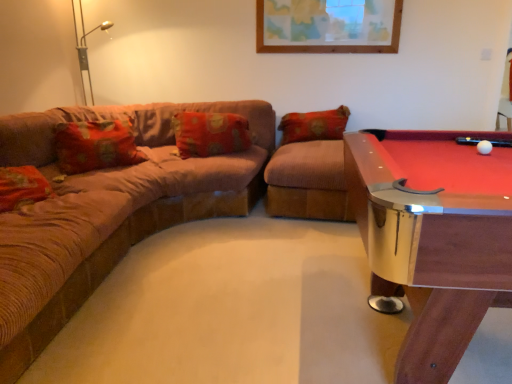
The height and width of the screenshot is (384, 512). What do you see at coordinates (111, 211) in the screenshot? I see `brown corduroy couch at left` at bounding box center [111, 211].

This screenshot has width=512, height=384. What do you see at coordinates (434, 237) in the screenshot? I see `wooden pool table at right` at bounding box center [434, 237].

The width and height of the screenshot is (512, 384). In order to click on brown corduroy couch at left in this screenshot , I will do `click(111, 211)`.

In terms of size, does brown corduroy couch at left appear bigger or smaller than wooden pool table at right?

brown corduroy couch at left is bigger than wooden pool table at right.

Which is behind, brown corduroy couch at left or wooden pool table at right?

wooden pool table at right is behind.

Between point (224, 205) and point (442, 185), which one is positioned in front?

Point (442, 185)

Does wooden pool table at right have a smaller size compared to brown corduroy couch at left?

Yes, wooden pool table at right is smaller than brown corduroy couch at left.

From a real-world perspective, is wooden pool table at right positioned under brown corduroy couch at left based on gravity?

No, from a real-world perspective, wooden pool table at right is not below brown corduroy couch at left.

Considering the sizes of objects wooden pool table at right and brown corduroy couch at left in the image provided, who is shorter, wooden pool table at right or brown corduroy couch at left?

Result: brown corduroy couch at left is shorter.

From the image's perspective, is wooden pool table at right over brown corduroy couch at left?

Actually, wooden pool table at right appears below brown corduroy couch at left in the image.

Is floral fabric pillow at center oriented towards brown corduroy couch at left?

Yes.

Which of these two, floral fabric pillow at center or brown corduroy couch at left, is bigger?

brown corduroy couch at left.

Is floral fabric pillow at center outside of brown corduroy couch at left?

That's incorrect, floral fabric pillow at center is not completely outside brown corduroy couch at left.

Which object is positioned more to the right, floral fabric pillow at center or brown corduroy couch at left?

Positioned to the right is floral fabric pillow at center.

Is floral fabric pillow at center situated inside wooden pool table at right or outside?

floral fabric pillow at center is spatially situated outside wooden pool table at right.

Is floral fabric pillow at center placed right next to wooden pool table at right?

No, floral fabric pillow at center is not in contact with wooden pool table at right.

Find the location of a particular element. The image size is (512, 384). billiard table to the right of floral fabric pillow at center is located at coordinates tap(434, 237).

From a real-world perspective, which object stands above the other?

From a 3D spatial view, floral fabric pillow at center is above.

Between wooden pool table at right and floral fabric pillow at center, which one appears on the left side from the viewer's perspective?

Positioned to the left is floral fabric pillow at center.

From a real-world perspective, is wooden pool table at right positioned over floral fabric pillow at center based on gravity?

No, from a real-world perspective, wooden pool table at right is not on top of floral fabric pillow at center.

In terms of height, does wooden pool table at right look taller or shorter compared to floral fabric pillow at center?

In the image, wooden pool table at right appears to be taller than floral fabric pillow at center.

Is wooden pool table at right directly adjacent to floral fabric pillow at center?

wooden pool table at right is not next to floral fabric pillow at center, and they're not touching.

Consider the image. Can you confirm if brown corduroy couch at left is positioned to the right of floral fabric pillow at center?

In fact, brown corduroy couch at left is to the left of floral fabric pillow at center.

Is brown corduroy couch at left behind floral fabric pillow at center?

No, it is in front of floral fabric pillow at center.

Is brown corduroy couch at left shorter than floral fabric pillow at center?

No, brown corduroy couch at left is not shorter than floral fabric pillow at center.

Find the location of `studio couch below the floral fabric pillow at center (from a real-world perspective)`. studio couch below the floral fabric pillow at center (from a real-world perspective) is located at coordinates (111, 211).

There is a brown corduroy couch at left. Where is `billiard table above it (from a real-world perspective)`? The width and height of the screenshot is (512, 384). billiard table above it (from a real-world perspective) is located at coordinates (434, 237).

Identify the location of billiard table on the right of the brown corduroy couch at left. This screenshot has height=384, width=512. pyautogui.click(x=434, y=237).

Looking at the image, which one is located further to brown corduroy couch at left, floral fabric pillow at center or wooden pool table at right?

Based on the image, wooden pool table at right appears to be further to brown corduroy couch at left.

From the picture: Considering their positions, is brown corduroy couch at left positioned closer to wooden pool table at right than floral fabric pillow at center?

brown corduroy couch at left.

From the image, which object appears to be nearer to brown corduroy couch at left, wooden pool table at right or floral fabric pillow at center?

The object closer to brown corduroy couch at left is floral fabric pillow at center.

Considering their positions, is floral fabric pillow at center positioned closer to wooden pool table at right than brown corduroy couch at left?

Based on the image, brown corduroy couch at left appears to be nearer to wooden pool table at right.

When comparing their distances from floral fabric pillow at center, does wooden pool table at right or brown corduroy couch at left seem further?

Based on the image, wooden pool table at right appears to be further to floral fabric pillow at center.

Estimate the real-world distances between objects in this image. Which object is further from floral fabric pillow at center, brown corduroy couch at left or wooden pool table at right?

The object further to floral fabric pillow at center is wooden pool table at right.

The width and height of the screenshot is (512, 384). Find the location of `billiard table positioned between brown corduroy couch at left and floral fabric pillow at center from near to far`. billiard table positioned between brown corduroy couch at left and floral fabric pillow at center from near to far is located at coordinates (434, 237).